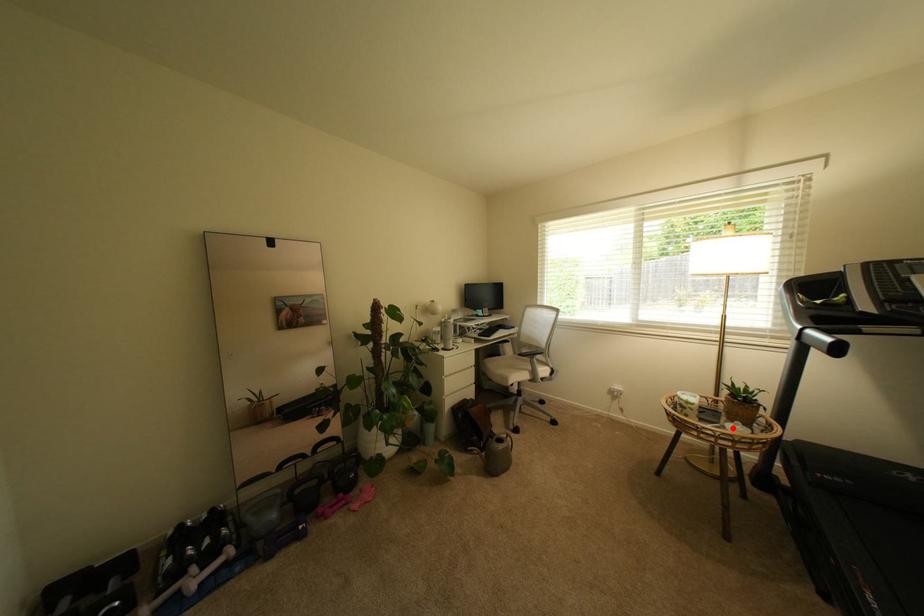
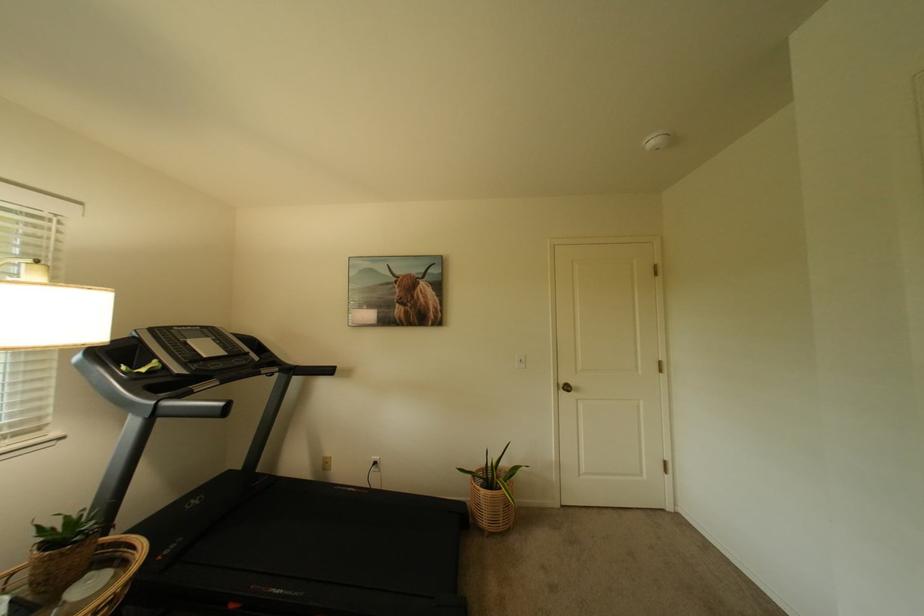
Locate, in the second image, the point that corresponds to the highlighted location in the first image.

(73, 605)